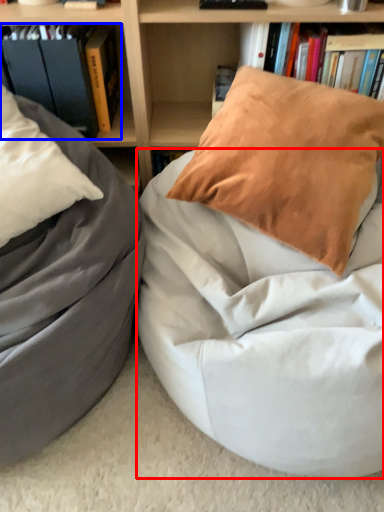
Question: Which object is closer to the camera taking this photo, mattress (highlighted by a red box) or book (highlighted by a blue box)?

Choices:
 (A) mattress
 (B) book

Answer: (A)